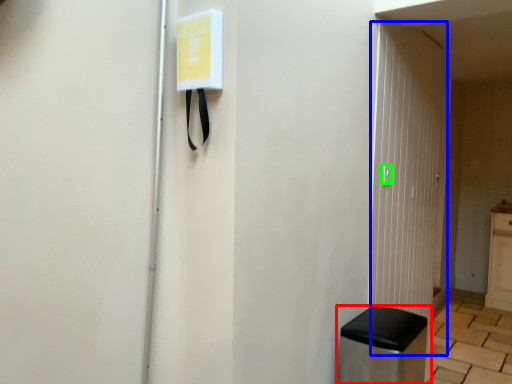
Question: Considering the real-world distances, which object is closest to furniture (highlighted by a red box)? glass door (highlighted by a blue box) or light switch (highlighted by a green box).

Choices:
 (A) glass door
 (B) light switch

Answer: (A)